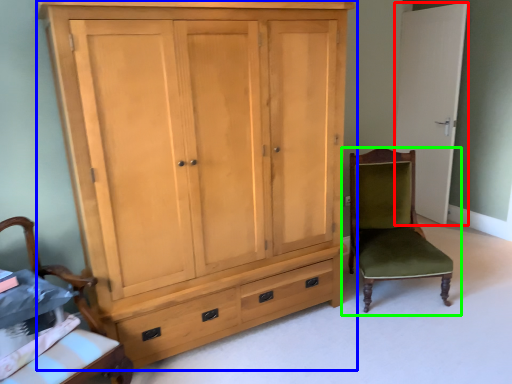
Question: Considering the real-world distances, which object is closest to door (highlighted by a red box)? cupboard (highlighted by a blue box) or chair (highlighted by a green box).

Choices:
 (A) cupboard
 (B) chair

Answer: (B)